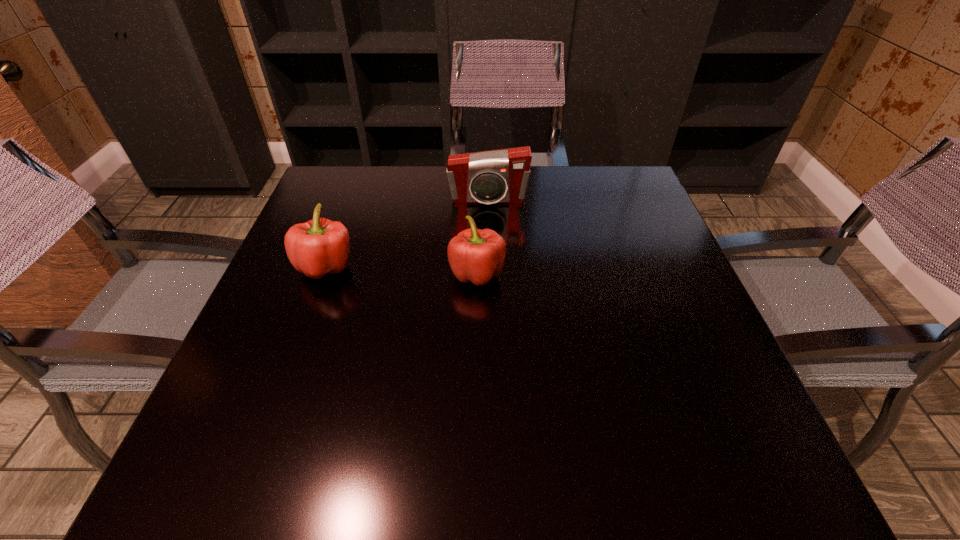
I want to click on free area in between the left bell pepper and the farthest object, so click(407, 233).

I want to click on vacant space that is in between the camera and the left bell pepper, so click(407, 233).

Where is `object that is the closest one to the farthest object`? This screenshot has height=540, width=960. object that is the closest one to the farthest object is located at coordinates (474, 255).

Choose which object is the second nearest neighbor to the left bell pepper. Please provide its 2D coordinates. Your answer should be formatted as a tuple, i.e. [(x, y)], where the tuple contains the x and y coordinates of a point satisfying the conditions above.

[(498, 176)]

Locate an element on the screen. This screenshot has width=960, height=540. vacant space that satisfies the following two spatial constraints: 1. on the front side of the right bell pepper; 2. on the right side of the leftmost object is located at coordinates (324, 273).

You are a GUI agent. You are given a task and a screenshot of the screen. Output one action in this format:
    pyautogui.click(x=<x>, y=<y>)
    Task: Click on the free spot that satisfies the following two spatial constraints: 1. on the front side of the right bell pepper; 2. on the left side of the leftmost object
    The image size is (960, 540).
    Given the screenshot: What is the action you would take?
    pyautogui.click(x=324, y=273)